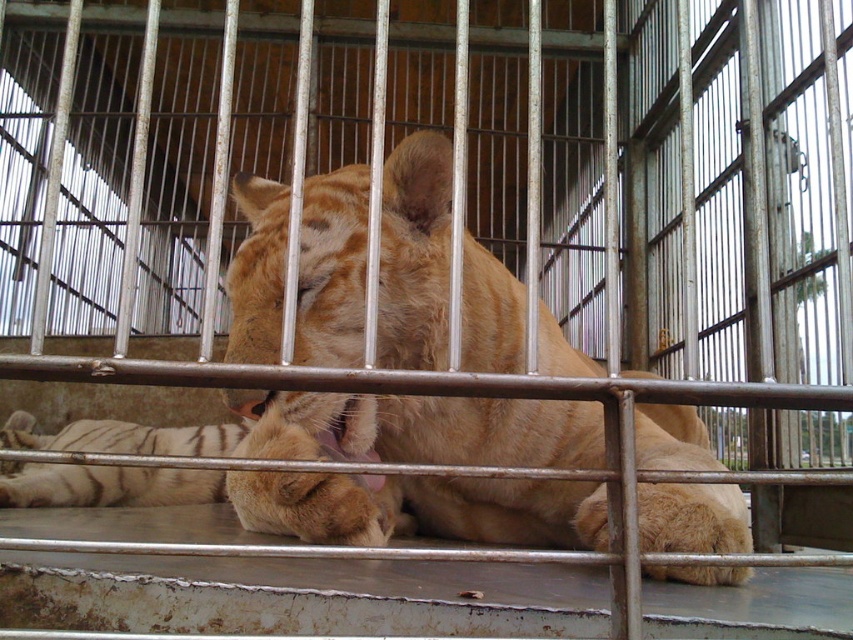
From the picture: Between orange fur tiger at center and white striped fur at lower left, which one is positioned lower?

white striped fur at lower left is lower down.

Is point (682, 531) closer to viewer compared to point (129, 502)?

Yes, it is.

At what (x,y) coordinates should I click in order to perform the action: click on orange fur tiger at center. Please return your answer as a coordinate pair (x, y). The image size is (853, 640). Looking at the image, I should click on (442, 428).